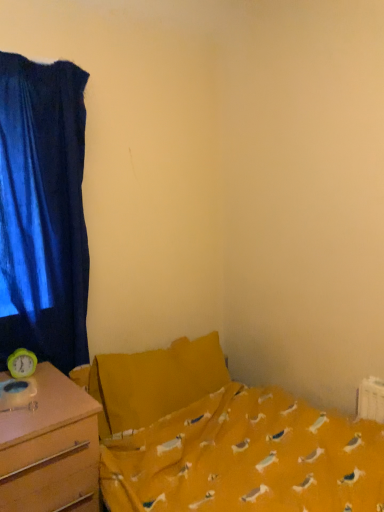
Question: Is velvet blue curtain at left placed right next to wooden desk at left?

Choices:
 (A) yes
 (B) no

Answer: (B)

Question: Is velvet blue curtain at left at the left side of wooden desk at left?

Choices:
 (A) yes
 (B) no

Answer: (A)

Question: Is velvet blue curtain at left positioned far away from wooden desk at left?

Choices:
 (A) no
 (B) yes

Answer: (A)

Question: Is velvet blue curtain at left at the right side of wooden desk at left?

Choices:
 (A) no
 (B) yes

Answer: (A)

Question: Is velvet blue curtain at left bigger than wooden desk at left?

Choices:
 (A) no
 (B) yes

Answer: (A)

Question: From a real-world perspective, is velvet blue curtain at left beneath wooden desk at left?

Choices:
 (A) no
 (B) yes

Answer: (A)

Question: Is wooden desk at left looking in the opposite direction of velvet blue curtain at left?

Choices:
 (A) yes
 (B) no

Answer: (B)

Question: Can you confirm if wooden desk at left is positioned to the left of velvet blue curtain at left?

Choices:
 (A) yes
 (B) no

Answer: (B)

Question: From the image's perspective, would you say wooden desk at left is shown under velvet blue curtain at left?

Choices:
 (A) no
 (B) yes

Answer: (B)

Question: From the image's perspective, is wooden desk at left above velvet blue curtain at left?

Choices:
 (A) no
 (B) yes

Answer: (A)

Question: From a real-world perspective, is wooden desk at left over velvet blue curtain at left?

Choices:
 (A) yes
 (B) no

Answer: (B)

Question: Considering the relative positions of wooden desk at left and velvet blue curtain at left in the image provided, is wooden desk at left to the right of velvet blue curtain at left from the viewer's perspective?

Choices:
 (A) no
 (B) yes

Answer: (B)

Question: Does yellow fabric bed at center have a larger size compared to velvet blue curtain at left?

Choices:
 (A) no
 (B) yes

Answer: (B)